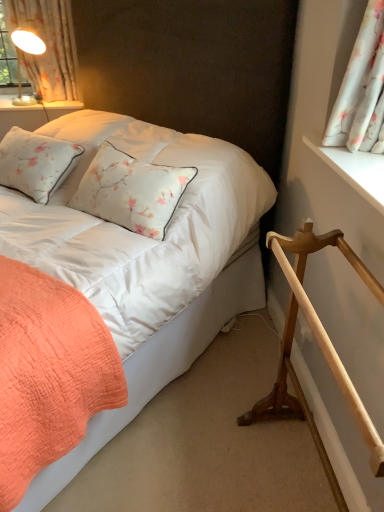
Question: From the image's perspective, relative to white floral fabric at upper left, which ranks as the 2th curtain in right-to-left order, is light brown wooden rail at lower right above or below?

Choices:
 (A) below
 (B) above

Answer: (A)

Question: Is light brown wooden rail at lower right in front of or behind white floral fabric at upper left, the 2th curtain in the bottom-to-top sequence, in the image?

Choices:
 (A) front
 (B) behind

Answer: (A)

Question: Which object is positioned closest to the white floral fabric at upper left, which ranks as the first curtain in back-to-front order?

Choices:
 (A) light brown wooden rail at lower right
 (B) coral quilted bed at lower left
 (C) white wooden window sill at upper right
 (D) white floral fabric at upper right, which is the first curtain in bottom-to-top order

Answer: (B)

Question: Which object is positioned closest to the white floral fabric at upper right, which ranks as the second curtain in left-to-right order?

Choices:
 (A) coral quilted bed at lower left
 (B) white floral fabric at upper left, which ranks as the 2th curtain in right-to-left order
 (C) light brown wooden rail at lower right
 (D) white wooden window sill at upper right

Answer: (D)